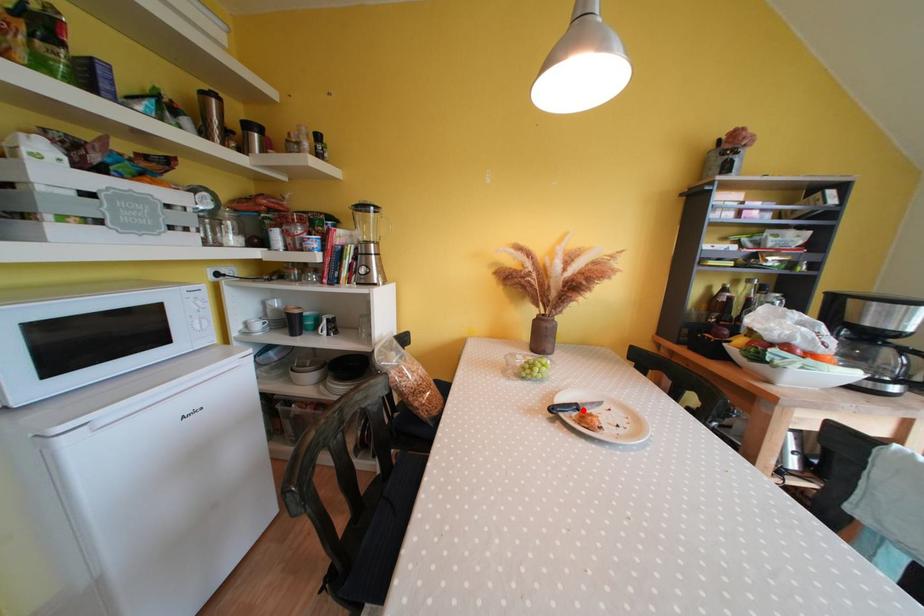
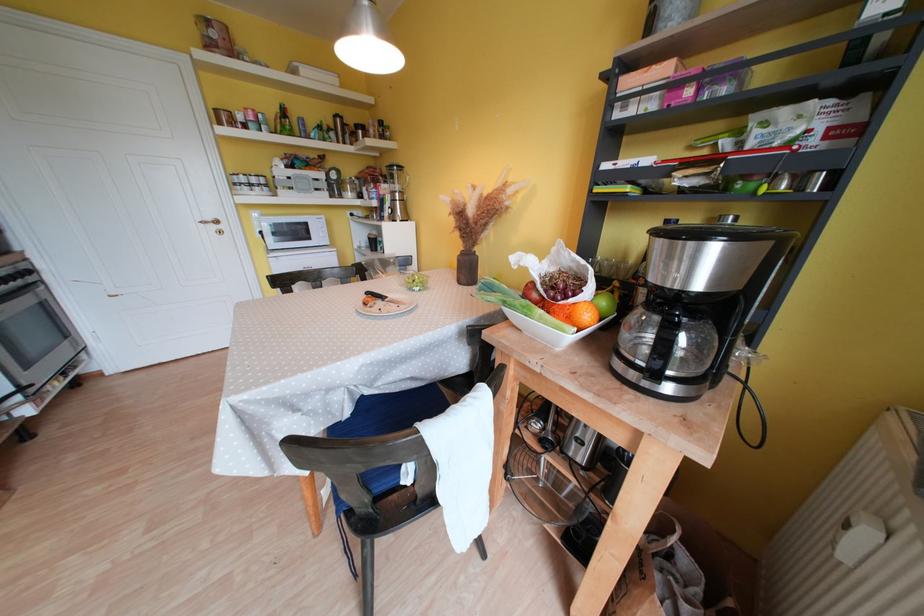
Where in the second image is the point corresponding to the highlighted location from the first image?

(390, 301)